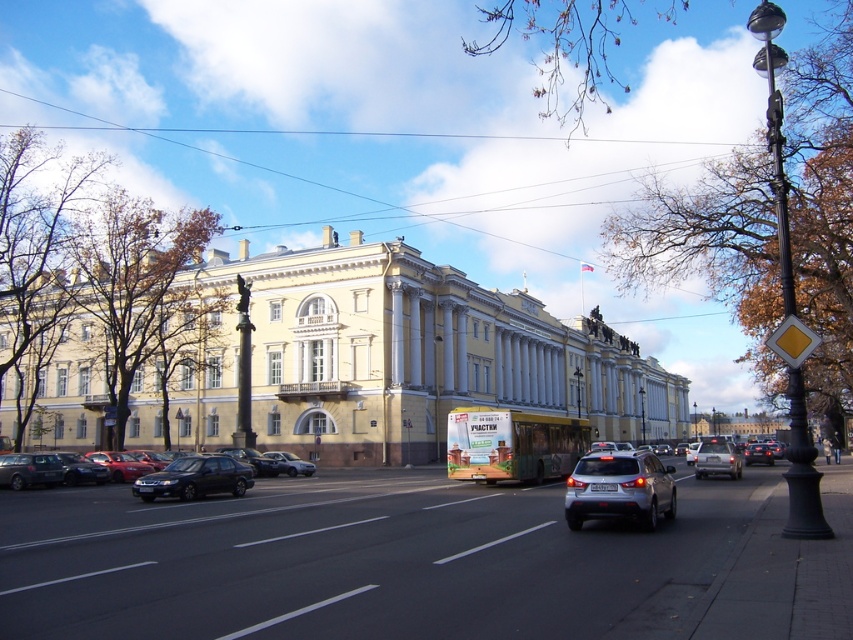
Question: Is satin silver suv at center behind satin black sedan at center?

Choices:
 (A) no
 (B) yes

Answer: (A)

Question: Which object is positioned closest to the satin black sedan at center?

Choices:
 (A) yellow stone building at center
 (B) satin silver sedan at center
 (C) matte black sedan at lower left

Answer: (C)

Question: Which point is closer to the camera taking this photo?

Choices:
 (A) (109, 474)
 (B) (151, 477)
 (C) (706, 467)

Answer: (B)

Question: Does satin silver suv at center have a lesser width compared to matte black sedan at lower left?

Choices:
 (A) no
 (B) yes

Answer: (B)

Question: Which of the following is the farthest from the observer?

Choices:
 (A) yellow stone building at center
 (B) matte black sedan at lower left

Answer: (A)

Question: Can you confirm if satin silver suv at center is positioned to the right of satin black sedan at center?

Choices:
 (A) no
 (B) yes

Answer: (B)